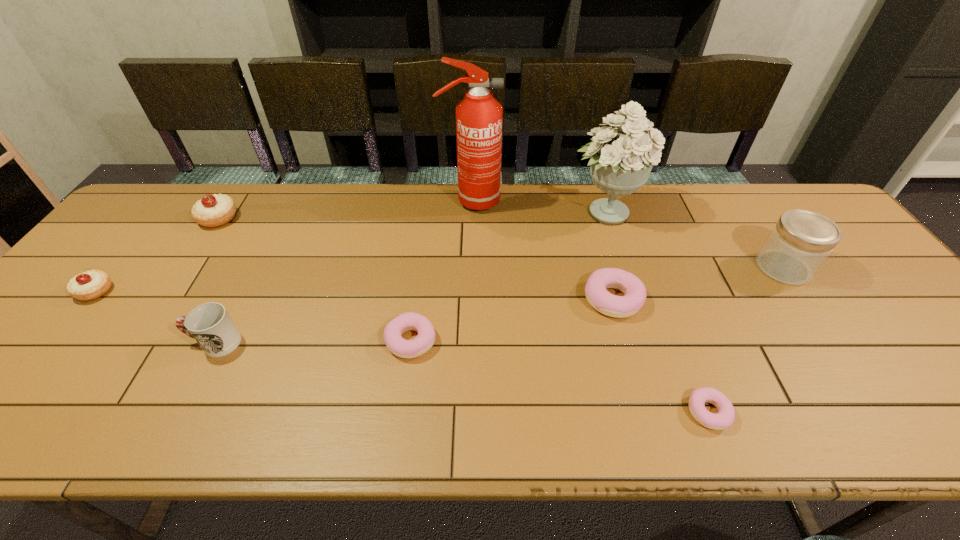
Identify which pink pastry is located as the nearest to the fourth tallest pastry. Please provide its 2D coordinates. Your answer should be formatted as a tuple, i.e. [(x, y)], where the tuple contains the x and y coordinates of a point satisfying the conditions above.

[(599, 298)]

Find the location of `pink pastry that is the second closest to the tallest pastry`. pink pastry that is the second closest to the tallest pastry is located at coordinates (599, 298).

Identify the location of free point that satisfies the following two spatial constraints: 1. on the back side of the shortest object; 2. at the nozzle of the tallest object. This screenshot has width=960, height=540. (627, 201).

Identify the location of free location that satisfies the following two spatial constraints: 1. on the handle side of the seventh object from right to left; 2. on the right side of the second tallest object. This screenshot has height=540, width=960. (281, 212).

Find the location of a particular element. The image size is (960, 540). vacant space that satisfies the following two spatial constraints: 1. on the back side of the green bouquet; 2. on the right side of the nearer beige pastry is located at coordinates (160, 212).